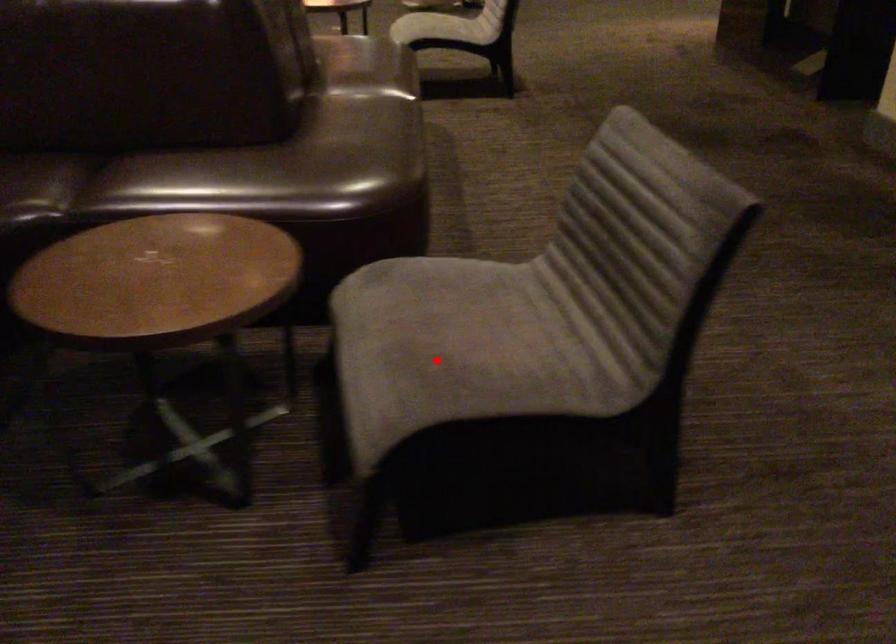
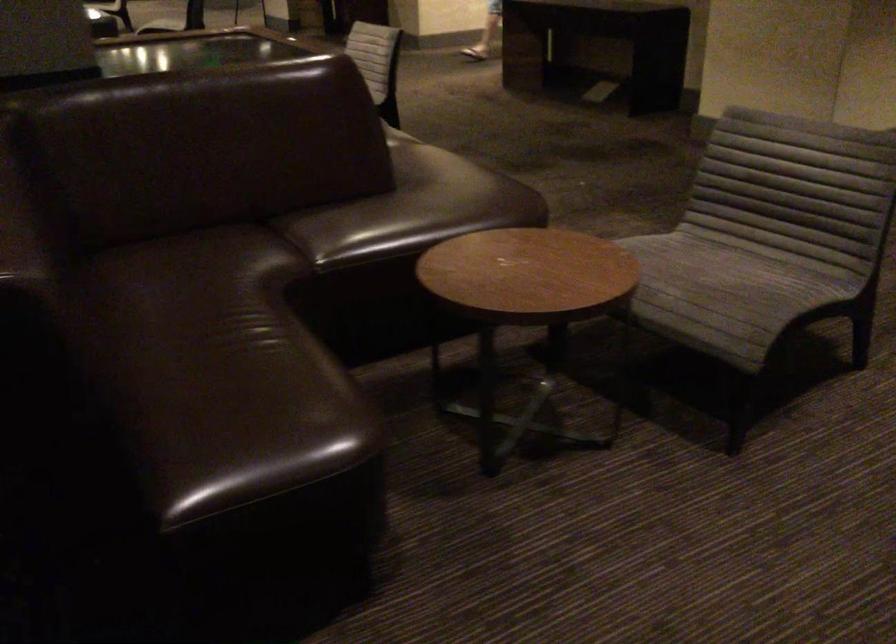
Question: I am providing you with two images of the same scene from different viewpoints. In image1, a red point is highlighted. Considering the same 3D point in image2, which of the following is correct?

Choices:
 (A) It is closer
 (B) It is farther

Answer: (B)